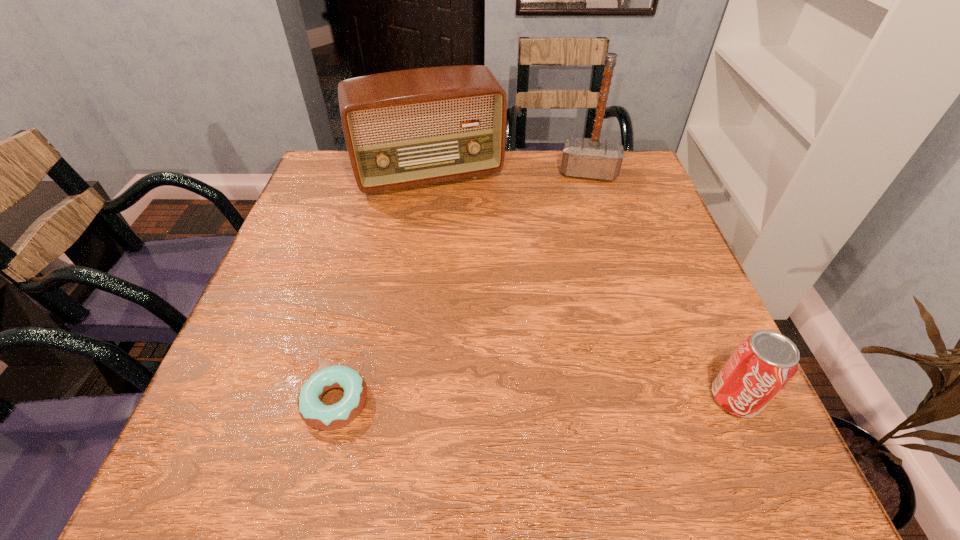
The height and width of the screenshot is (540, 960). In order to click on vacant area that lies between the tallest object and the third shortest object in this screenshot , I will do `click(509, 174)`.

Identify the location of object that is the third closest to the shortest object. [582, 157].

Where is `object that stands as the closest to the radio receiver`? This screenshot has width=960, height=540. object that stands as the closest to the radio receiver is located at coordinates (582, 157).

Identify the location of free space that satisfies the following two spatial constraints: 1. on the back side of the tallest object; 2. on the left side of the third shortest object. The height and width of the screenshot is (540, 960). (429, 173).

Locate an element on the screen. The height and width of the screenshot is (540, 960). vacant space that satisfies the following two spatial constraints: 1. on the back side of the shortest object; 2. on the left side of the tallest object is located at coordinates (393, 173).

Identify the location of vacant space that satisfies the following two spatial constraints: 1. on the back side of the shortest object; 2. on the right side of the soda can. Image resolution: width=960 pixels, height=540 pixels. (336, 398).